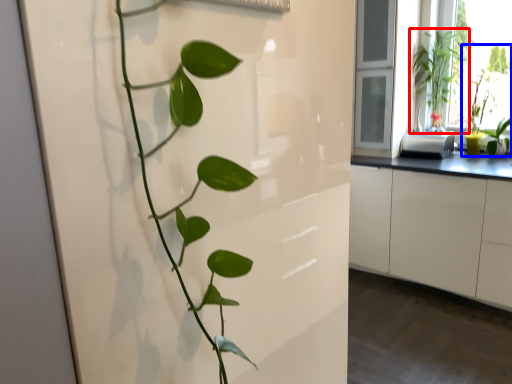
Question: Among these objects, which one is nearest to the camera, houseplant (highlighted by a red box) or houseplant (highlighted by a blue box)?

Choices:
 (A) houseplant
 (B) houseplant

Answer: (B)